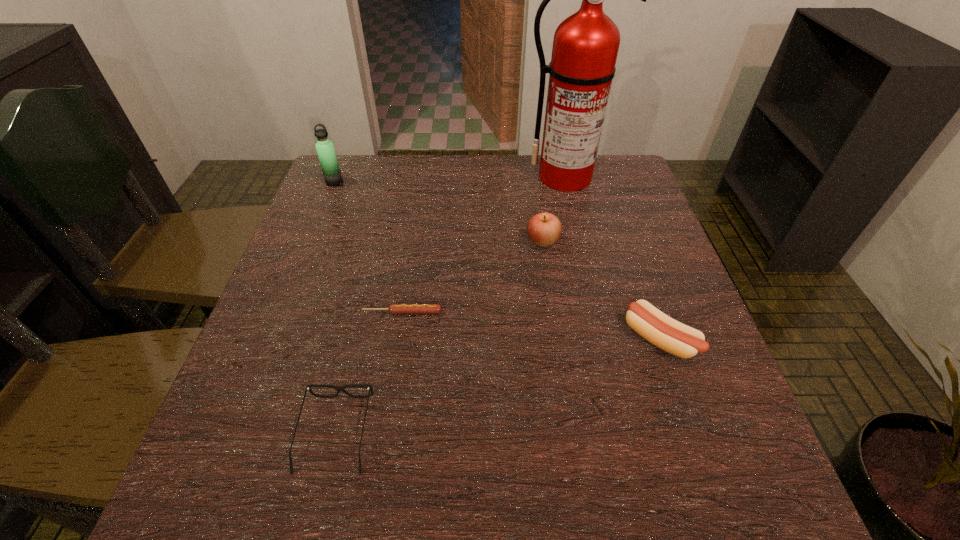
Find the location of a particular element. This screenshot has height=540, width=960. free space between the second tallest object and the shorter sausage is located at coordinates pos(369,247).

Select which object appears as the closest to the taller sausage. Please provide its 2D coordinates. Your answer should be formatted as a tuple, i.e. [(x, y)], where the tuple contains the x and y coordinates of a point satisfying the conditions above.

[(544, 229)]

Choose which object is the second nearest neighbor to the right sausage. Please provide its 2D coordinates. Your answer should be formatted as a tuple, i.e. [(x, y)], where the tuple contains the x and y coordinates of a point satisfying the conditions above.

[(393, 308)]

Identify the location of free spot that satisfies the following two spatial constraints: 1. at the nozzle of the fire extinguisher; 2. on the right side of the fourth tallest object. This screenshot has width=960, height=540. (602, 339).

At what (x,y) coordinates should I click in order to perform the action: click on vacant area in the image that satisfies the following two spatial constraints: 1. on the front side of the apple; 2. on the left side of the taller sausage. Please return your answer as a coordinate pair (x, y). The height and width of the screenshot is (540, 960). Looking at the image, I should click on (557, 339).